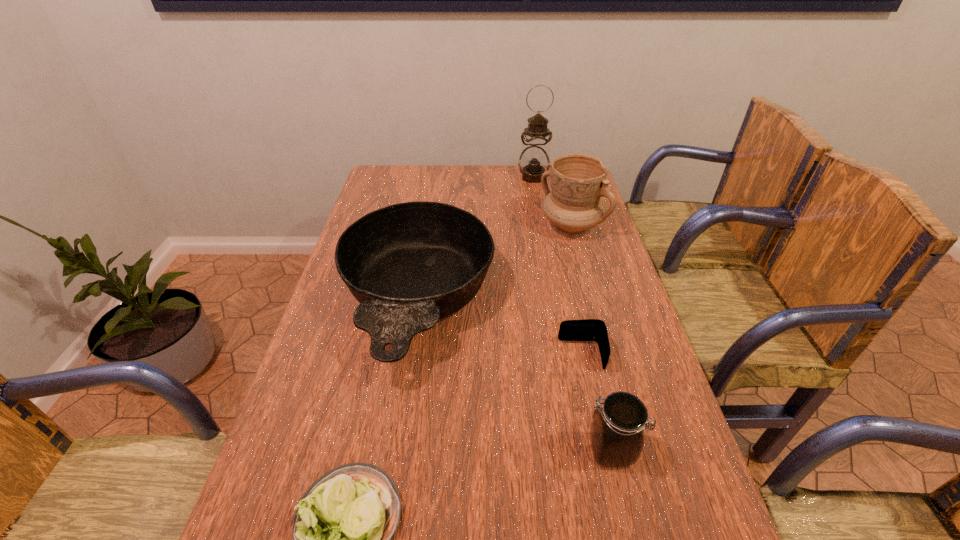
Locate an element on the screen. wallet at the right edge is located at coordinates (588, 329).

I want to click on object at the far right corner, so click(534, 160).

The image size is (960, 540). In the image, there is a desktop. Identify the location of vacant space at the far edge. (519, 194).

At what (x,y) coordinates should I click in order to perform the action: click on blank space at the left edge of the desktop. Please return your answer as a coordinate pair (x, y). The width and height of the screenshot is (960, 540). Looking at the image, I should click on (336, 342).

Locate an element on the screen. This screenshot has height=540, width=960. free region at the right edge of the desktop is located at coordinates (653, 522).

The image size is (960, 540). What are the coordinates of `free space between the jar and the frying pan` in the screenshot? It's located at (514, 376).

This screenshot has height=540, width=960. Identify the location of vacant area that lies between the jar and the frying pan. (514, 376).

Locate an element on the screen. free spot between the jar and the farthest object is located at coordinates (572, 314).

You are a GUI agent. You are given a task and a screenshot of the screen. Output one action in this format:
    pyautogui.click(x=<x>, y=<y>)
    Task: Click on the empty location between the wallet and the jar
    
    Given the screenshot: What is the action you would take?
    pyautogui.click(x=596, y=403)

Identify the location of blank region between the wallet and the oil lamp. This screenshot has width=960, height=540. (558, 266).